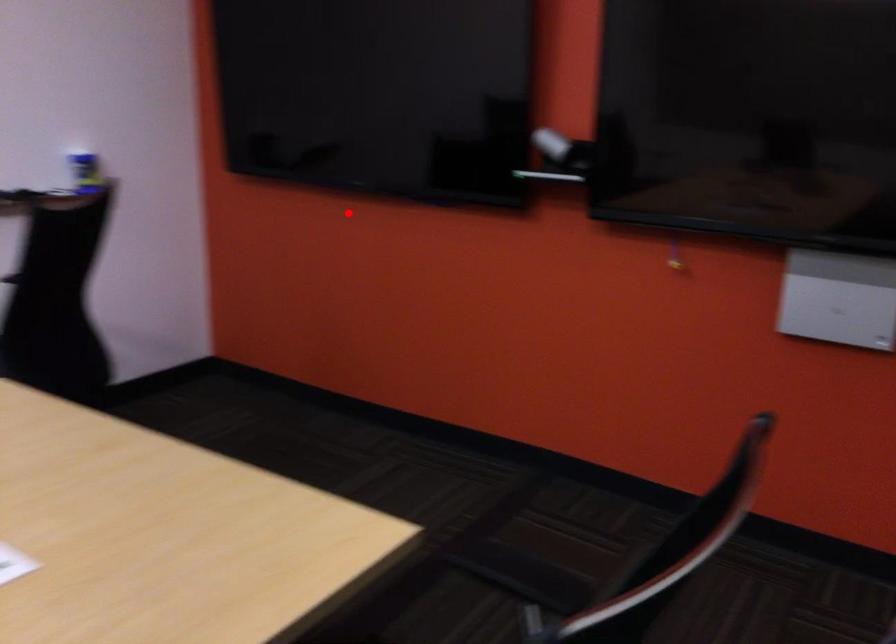
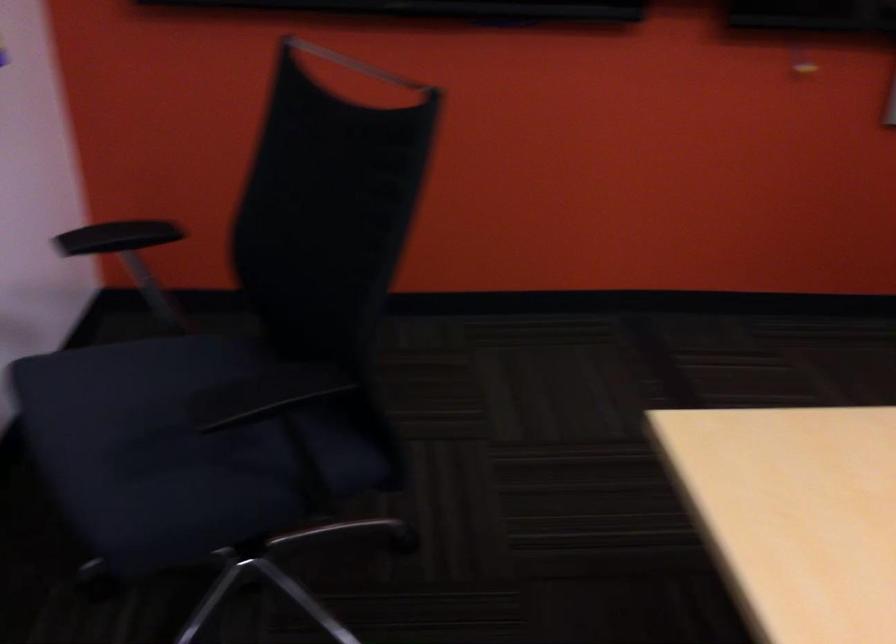
Question: I am providing you with two images of the same scene from different viewpoints. Given a red point in image1, look at the same physical point in image2. Is it:

Choices:
 (A) Closer to the viewpoint
 (B) Farther from the viewpoint

Answer: (A)